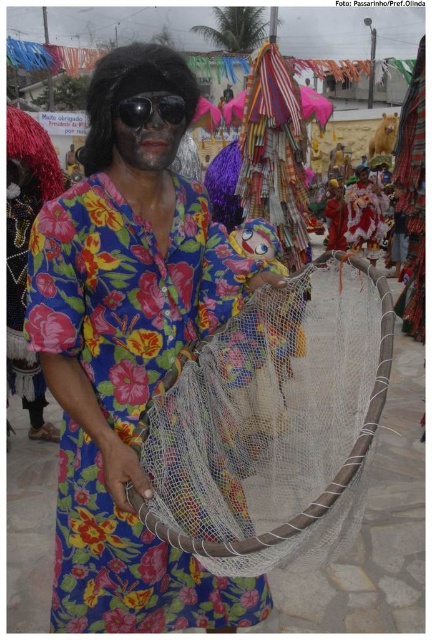
Can you confirm if black synthetic wig at upper left is positioned to the right of black reflective sunglasses at center?

No, black synthetic wig at upper left is not to the right of black reflective sunglasses at center.

Identify the location of black synthetic wig at upper left. point(133,93).

Which is above, white mesh net at center or black synthetic wig at upper left?

Positioned higher is black synthetic wig at upper left.

Is point (250, 502) behind point (177, 93)?

Yes, point (250, 502) is farther from viewer.

Find the location of a particular element. The height and width of the screenshot is (640, 432). white mesh net at center is located at coordinates (272, 420).

Is point (374, 371) farther from camera compared to point (142, 102)?

That is False.

Does white mesh net at center have a smaller size compared to black reflective sunglasses at center?

Actually, white mesh net at center might be larger than black reflective sunglasses at center.

Is point (266, 358) more distant than point (146, 106)?

Yes, point (266, 358) is farther from viewer.

Where is `white mesh net at center`? white mesh net at center is located at coordinates (272, 420).